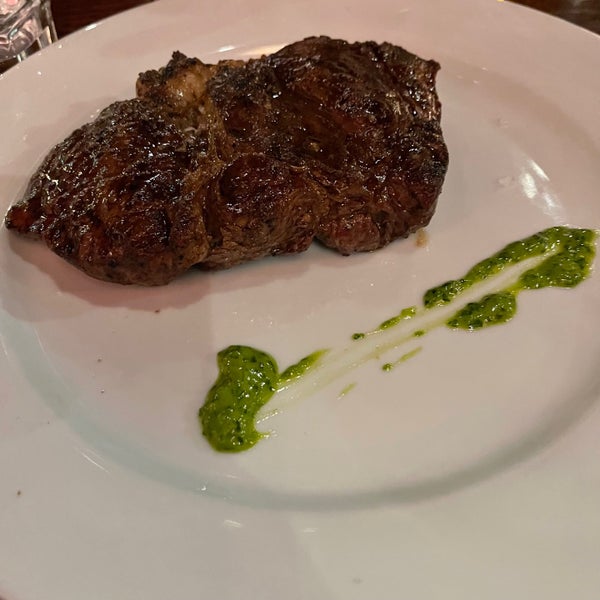
Identify the location of plate. The height and width of the screenshot is (600, 600). (401, 465).